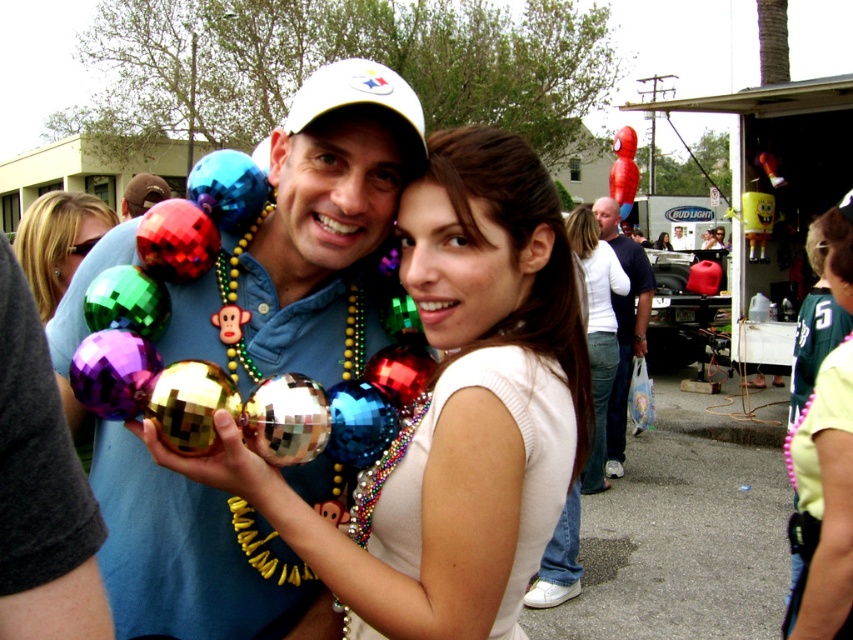
Question: Which of these objects is positioned farthest from the matte green balloon at left?

Choices:
 (A) shiny metallic ball at center
 (B) matte white shirt at center

Answer: (B)

Question: Which of the following is the closest to the observer?

Choices:
 (A) (830, 356)
 (B) (602, 468)
 (C) (378, 541)
 (D) (126, 188)

Answer: (C)

Question: Is pink beaded necklace at center thinner than white cotton t-shirt at center?

Choices:
 (A) no
 (B) yes

Answer: (B)

Question: Does shiny metallic ball at center have a larger size compared to matte white shirt at center?

Choices:
 (A) no
 (B) yes

Answer: (B)

Question: Is shiny metallic ornaments at center to the right of white cotton t-shirt at center from the viewer's perspective?

Choices:
 (A) no
 (B) yes

Answer: (A)

Question: Which point is farther to the camera?

Choices:
 (A) shiny metallic ornaments at center
 (B) matte white shirt at center

Answer: (B)